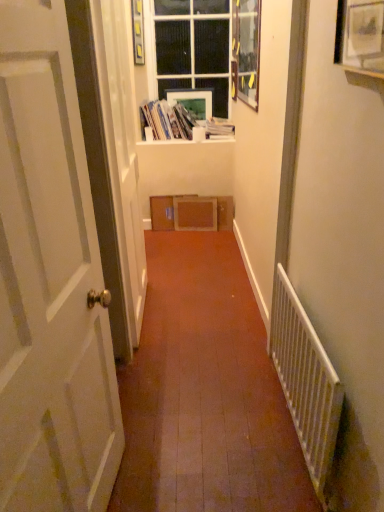
Question: Relative to clear glass window at upper center, is white cardboard box at upper center, which appears as the 2th book when viewed from the right, in front or behind?

Choices:
 (A) behind
 (B) front

Answer: (A)

Question: Considering the positions of white cardboard box at upper center, which appears as the 2th book when viewed from the right, and clear glass window at upper center in the image, is white cardboard box at upper center, which appears as the 2th book when viewed from the right, wider or thinner than clear glass window at upper center?

Choices:
 (A) thin
 (B) wide

Answer: (B)

Question: Considering the real-world distances, which object is farthest from the white paper book at upper center, placed as the second book when sorted from left to right?

Choices:
 (A) matte white picture frame at upper center, which is counted as the second picture frame, starting from the back
 (B) white matte window sill at upper center
 (C) clear glass window at upper center
 (D) matte white picture frame at upper center, the fourth picture frame when ordered from front to back
 (E) wooden picture frame at upper center, which ranks as the 3th picture frame in back-to-front order

Answer: (A)

Question: Estimate the real-world distances between objects in this image. Which object is farther from the matte white picture frame at upper center, which is counted as the third picture frame, starting from the front?

Choices:
 (A) white paper book at upper center, which ranks as the first book in right-to-left order
 (B) white matte window sill at upper center
 (C) clear glass window at upper center
 (D) brown cardboard box at center
 (E) white cardboard box at upper center, which appears as the 2th book when viewed from the right

Answer: (D)